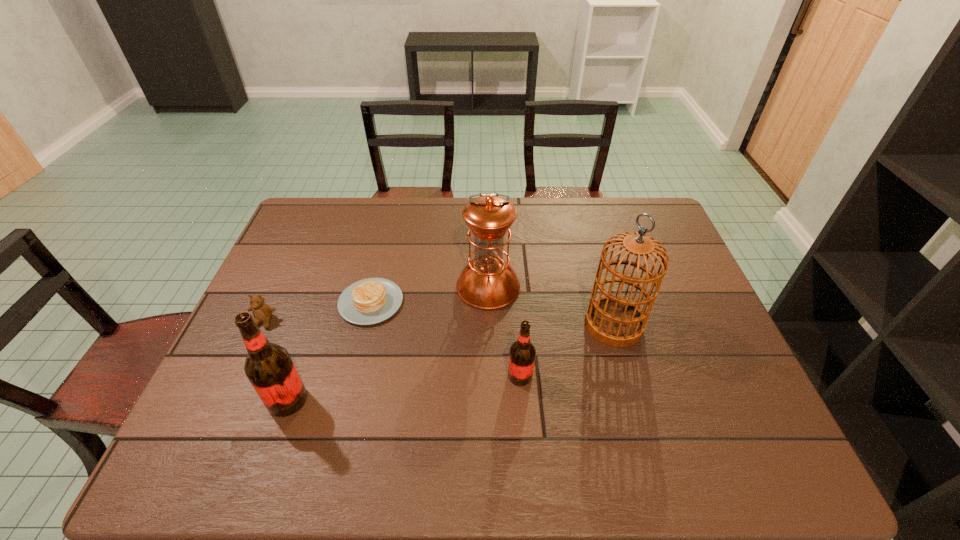
In the image, there is a desktop. Where is `vacant space at the far edge`? The width and height of the screenshot is (960, 540). vacant space at the far edge is located at coordinates (599, 214).

Locate an element on the screen. This screenshot has width=960, height=540. vacant space at the near edge of the desktop is located at coordinates (479, 423).

You are a GUI agent. You are given a task and a screenshot of the screen. Output one action in this format:
    pyautogui.click(x=<x>, y=<y>)
    Task: Click on the blank area at the left edge
    
    Given the screenshot: What is the action you would take?
    click(x=302, y=258)

The width and height of the screenshot is (960, 540). Identify the location of blank space at the right edge of the desktop. (682, 353).

This screenshot has width=960, height=540. In the image, there is a desktop. What are the coordinates of `free space at the far right corner` in the screenshot? It's located at (645, 204).

Image resolution: width=960 pixels, height=540 pixels. Identify the location of vacant area at the near right corner of the desktop. (747, 395).

Locate an element on the screen. This screenshot has height=540, width=960. free area in between the fourth object from right to left and the birdcage is located at coordinates (492, 313).

Where is `blank region between the birdcage and the taller root beer`? blank region between the birdcage and the taller root beer is located at coordinates (450, 362).

I want to click on blank region between the oil lamp and the shorter root beer, so click(x=504, y=331).

Find the location of a particular element. unoccupied position between the second shortest object and the rightmost object is located at coordinates (439, 323).